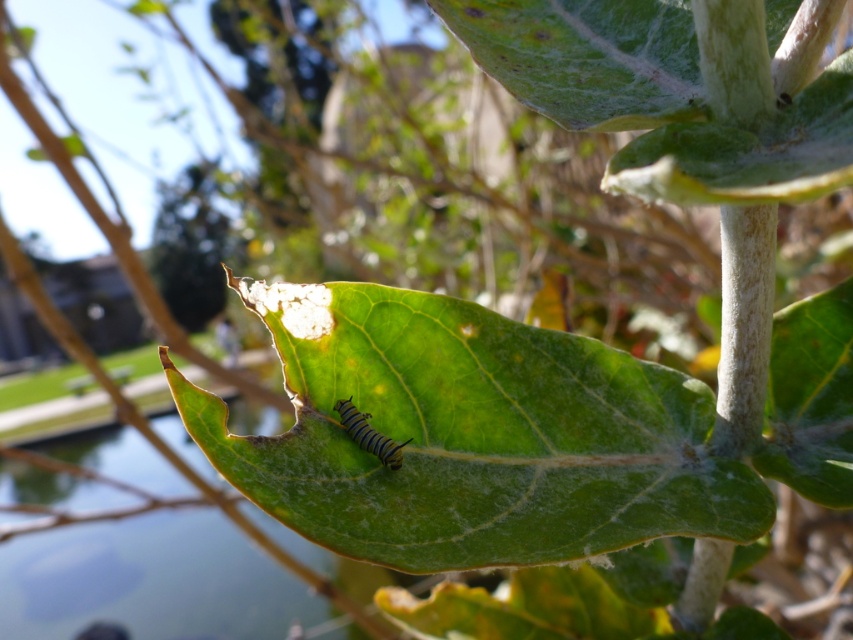
Question: Can you confirm if green matte leaf at center is positioned to the right of yellow striped caterpillar at center?

Choices:
 (A) yes
 (B) no

Answer: (A)

Question: Can you confirm if green matte leaf at center is positioned below yellow striped caterpillar at center?

Choices:
 (A) yes
 (B) no

Answer: (A)

Question: Which of the following is the farthest from the observer?

Choices:
 (A) (334, 404)
 (B) (408, 348)

Answer: (B)

Question: Does green matte leaf at center have a larger size compared to yellow striped caterpillar at center?

Choices:
 (A) yes
 (B) no

Answer: (A)

Question: Which object appears closest to the camera in this image?

Choices:
 (A) yellow striped caterpillar at center
 (B) green matte leaf at center

Answer: (B)